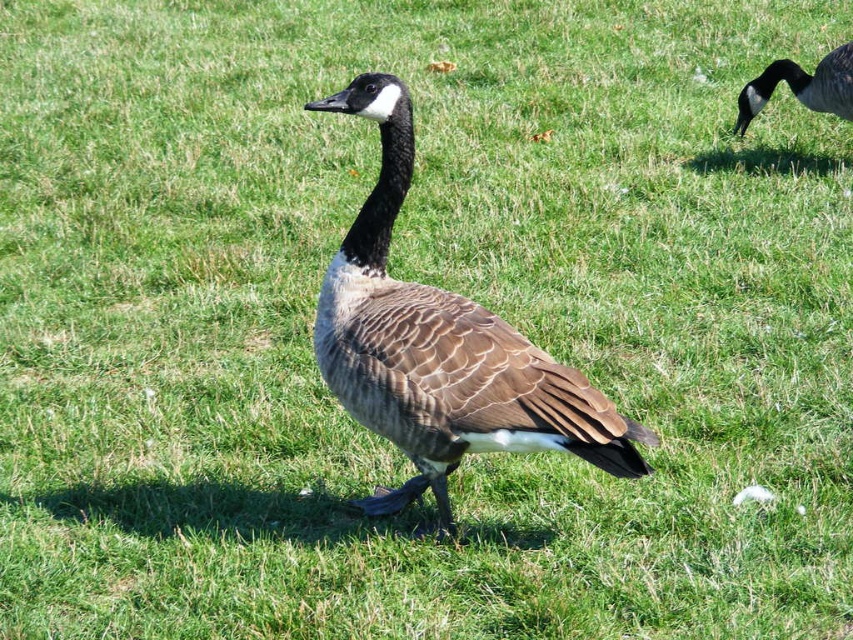
Does brown feathered duck at center have a lesser height compared to brown feathered goose at upper right?

No, brown feathered duck at center is not shorter than brown feathered goose at upper right.

Locate an element on the screen. brown feathered duck at center is located at coordinates (440, 348).